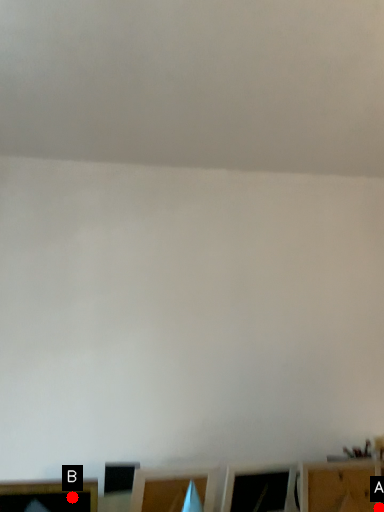
Question: Two points are circled on the image, labeled by A and B beside each circle. Which point is closer to the camera taking this photo?

Choices:
 (A) A is closer
 (B) B is closer

Answer: (B)